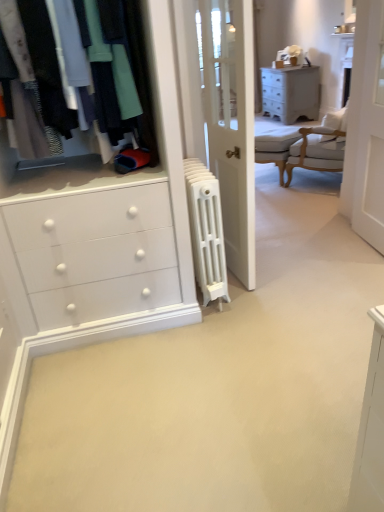
Question: Considering their positions, is matte gray chest of drawers at upper right located in front of or behind white upholstered chair at upper right?

Choices:
 (A) behind
 (B) front

Answer: (A)

Question: From a real-world perspective, is matte gray chest of drawers at upper right physically located above or below white upholstered chair at upper right?

Choices:
 (A) below
 (B) above

Answer: (A)

Question: Estimate the real-world distances between objects in this image. Which object is farther from the light gray fabric armchair at center?

Choices:
 (A) matte gray chest of drawers at upper right
 (B) white cast iron radiator at center
 (C) white upholstered chair at upper right
 (D) matte black clothing at upper left
 (E) white wood screen door at upper right

Answer: (D)

Question: Considering the real-world distances, which object is closest to the white wood screen door at upper right?

Choices:
 (A) white upholstered chair at upper right
 (B) matte gray chest of drawers at upper right
 (C) white cast iron radiator at center
 (D) matte black clothing at upper left
 (E) light gray fabric armchair at center

Answer: (A)